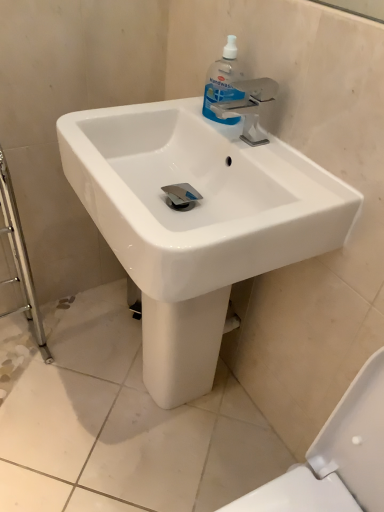
Identify the location of white glossy sink at center. (196, 222).

Describe the element at coordinates (196, 222) in the screenshot. This screenshot has height=512, width=384. I see `white glossy sink at center` at that location.

What do you see at coordinates (223, 83) in the screenshot? This screenshot has width=384, height=512. I see `clear plastic handwash at upper center` at bounding box center [223, 83].

Locate an element on the screen. clear plastic handwash at upper center is located at coordinates (223, 83).

This screenshot has width=384, height=512. Find the location of `white glossy sink at center`. white glossy sink at center is located at coordinates (196, 222).

Between clear plastic handwash at upper center and white glossy sink at center, which one appears on the left side from the viewer's perspective?

From the viewer's perspective, white glossy sink at center appears more on the left side.

Considering their positions, is clear plastic handwash at upper center located in front of or behind white glossy sink at center?

In the image, clear plastic handwash at upper center appears behind white glossy sink at center.

Does point (212, 100) come behind point (193, 234)?

Yes, point (212, 100) is behind point (193, 234).

From the image's perspective, is clear plastic handwash at upper center over white glossy sink at center?

Yes, from the image's perspective, clear plastic handwash at upper center is on top of white glossy sink at center.

From a real-world perspective, who is located higher, clear plastic handwash at upper center or white glossy sink at center?

clear plastic handwash at upper center.

Looking at their sizes, would you say clear plastic handwash at upper center is wider or thinner than white glossy sink at center?

In the image, clear plastic handwash at upper center appears to be more narrow than white glossy sink at center.

Considering the relative sizes of clear plastic handwash at upper center and white glossy sink at center in the image provided, is clear plastic handwash at upper center taller than white glossy sink at center?

In fact, clear plastic handwash at upper center may be shorter than white glossy sink at center.

Who is smaller, clear plastic handwash at upper center or white glossy sink at center?

clear plastic handwash at upper center.

Is clear plastic handwash at upper center not inside white glossy sink at center?

No, clear plastic handwash at upper center is inside white glossy sink at center's boundary.

Is clear plastic handwash at upper center positioned far away from white glossy sink at center?

No, there isn't a large distance between clear plastic handwash at upper center and white glossy sink at center.

Could you tell me if clear plastic handwash at upper center is turned towards white glossy sink at center?

Yes, clear plastic handwash at upper center is turned towards white glossy sink at center.

Find the location of `sink in front of the clear plastic handwash at upper center`. sink in front of the clear plastic handwash at upper center is located at coordinates (196, 222).

Which is more to the left, white glossy sink at center or clear plastic handwash at upper center?

From the viewer's perspective, white glossy sink at center appears more on the left side.

In the scene shown: Which object is further away from the camera, white glossy sink at center or clear plastic handwash at upper center?

clear plastic handwash at upper center.

Is point (196, 223) positioned in front of point (213, 90)?

Yes, it is in front of point (213, 90).

From the image's perspective, between white glossy sink at center and clear plastic handwash at upper center, who is located below?

white glossy sink at center is shown below in the image.

Based on the photo, from a real-world perspective, is white glossy sink at center positioned above or below clear plastic handwash at upper center?

From a real-world perspective, white glossy sink at center is physically below clear plastic handwash at upper center.

From the picture: Between white glossy sink at center and clear plastic handwash at upper center, which one has larger width?

With larger width is white glossy sink at center.

Which of these two, white glossy sink at center or clear plastic handwash at upper center, stands shorter?

With less height is clear plastic handwash at upper center.

Does white glossy sink at center have a smaller size compared to clear plastic handwash at upper center?

No.

Is white glossy sink at center inside the boundaries of clear plastic handwash at upper center, or outside?

white glossy sink at center lies outside clear plastic handwash at upper center.

Is white glossy sink at center far from clear plastic handwash at upper center?

No, white glossy sink at center is in close proximity to clear plastic handwash at upper center.

Is white glossy sink at center positioned with its back to clear plastic handwash at upper center?

Absolutely, white glossy sink at center is directed away from clear plastic handwash at upper center.

The image size is (384, 512). Find the location of `sink directly beneath the clear plastic handwash at upper center (from a real-world perspective)`. sink directly beneath the clear plastic handwash at upper center (from a real-world perspective) is located at coordinates (196, 222).

The image size is (384, 512). What are the coordinates of `sink on the left side of clear plastic handwash at upper center` in the screenshot? It's located at (196, 222).

The image size is (384, 512). I want to click on sink in front of the clear plastic handwash at upper center, so click(196, 222).